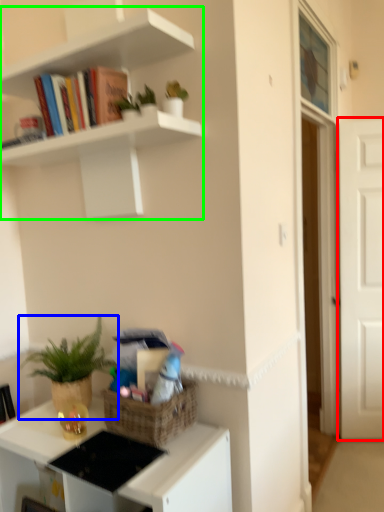
Question: Which is nearer to the door (highlighted by a red box)? houseplant (highlighted by a blue box) or shelf (highlighted by a green box).

Choices:
 (A) houseplant
 (B) shelf

Answer: (B)